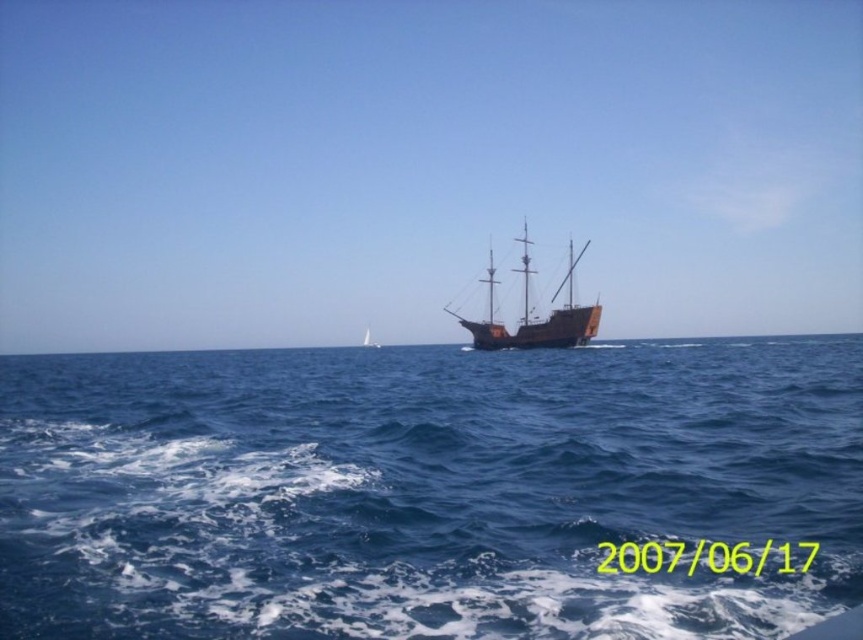
Question: Estimate the real-world distances between objects in this image. Which object is farther from the blue water at center?

Choices:
 (A) wooden ship at center
 (B) brown wooden ship at center

Answer: (B)

Question: Which point is closer to the camera?

Choices:
 (A) brown wooden ship at center
 (B) blue water at center
 (C) wooden ship at center

Answer: (B)

Question: Is blue water at center thinner than brown wooden ship at center?

Choices:
 (A) yes
 (B) no

Answer: (B)

Question: Is the position of blue water at center less distant than that of brown wooden ship at center?

Choices:
 (A) yes
 (B) no

Answer: (A)

Question: Among these objects, which one is farthest from the camera?

Choices:
 (A) blue water at center
 (B) brown wooden ship at center

Answer: (B)

Question: In this image, where is blue water at center located relative to wooden ship at center?

Choices:
 (A) above
 (B) below

Answer: (B)